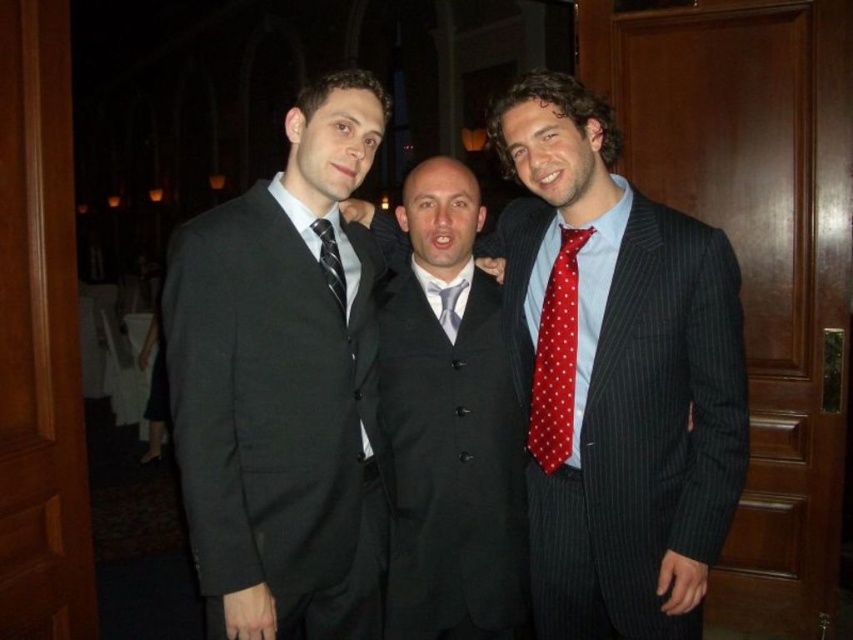
Question: Is black wool suit at left to the right of red dotted tie at right from the viewer's perspective?

Choices:
 (A) no
 (B) yes

Answer: (A)

Question: Among these objects, which one is nearest to the camera?

Choices:
 (A) black silk tie at center
 (B) black wool suit at center
 (C) red dotted tie at right

Answer: (A)

Question: Which point is closer to the camera taking this photo?

Choices:
 (A) (531, 392)
 (B) (322, 250)
 (C) (454, 294)
 (D) (570, 438)

Answer: (D)

Question: Does red dotted tie at right appear on the right side of black silk tie at center?

Choices:
 (A) yes
 (B) no

Answer: (A)

Question: Does black wool suit at center have a lesser width compared to silvery satin tie at center?

Choices:
 (A) yes
 (B) no

Answer: (B)

Question: Which point is closer to the camera taking this photo?

Choices:
 (A) 567,541
 (B) 254,346
 (C) 341,304
 (D) 442,316

Answer: (B)